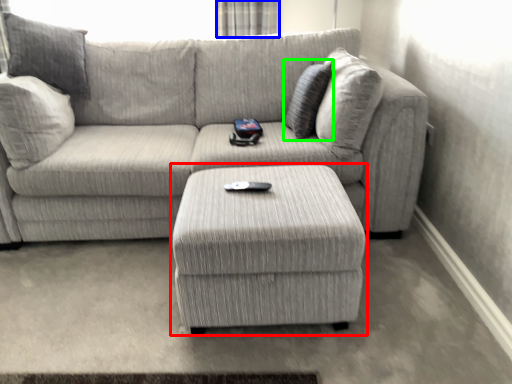
Question: Estimate the real-world distances between objects in this image. Which object is farther from table (highlighted by a red box), curtain (highlighted by a blue box) or pillow (highlighted by a green box)?

Choices:
 (A) curtain
 (B) pillow

Answer: (A)